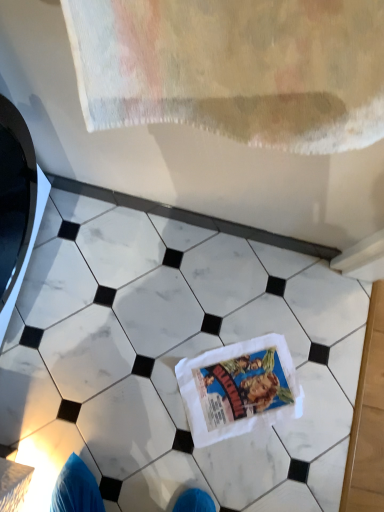
The image size is (384, 512). Identify the location of free space above white cotton comic book at center (from a real-world perspective). (243, 382).